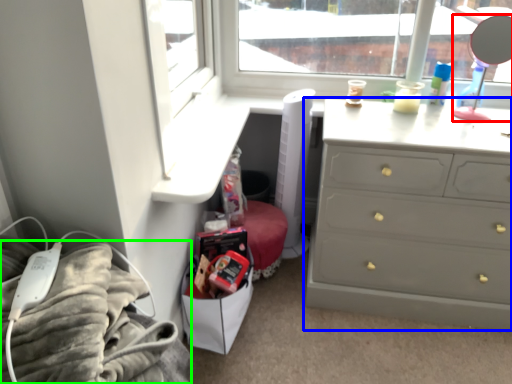
Question: Estimate the real-world distances between objects in this image. Which object is farther from mirror (highlighted by a red box), chest of drawers (highlighted by a blue box) or bedding (highlighted by a green box)?

Choices:
 (A) chest of drawers
 (B) bedding

Answer: (B)